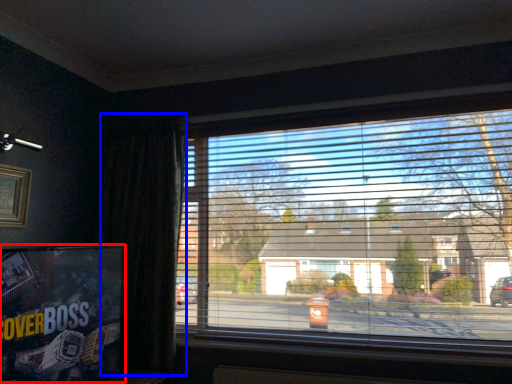
Question: Which of the following is the closest to the observer, tv show (highlighted by a red box) or curtain (highlighted by a blue box)?

Choices:
 (A) tv show
 (B) curtain

Answer: (A)